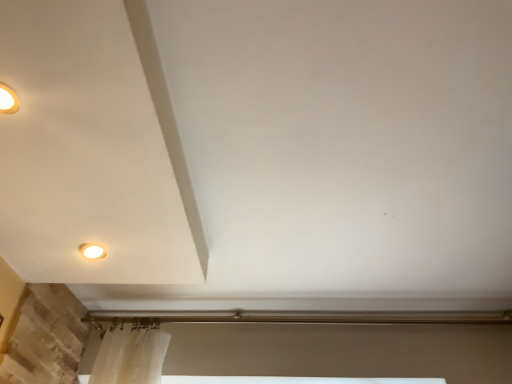
Question: Considering their positions, is matte white lamp at lower left located in front of or behind white glossy light fixture at upper left?

Choices:
 (A) behind
 (B) front

Answer: (A)

Question: Considering the relative positions of matte white lamp at lower left and white glossy light fixture at upper left in the image provided, is matte white lamp at lower left to the left or to the right of white glossy light fixture at upper left?

Choices:
 (A) left
 (B) right

Answer: (B)

Question: Considering the positions of point (94, 248) and point (1, 99), is point (94, 248) closer or farther from the camera than point (1, 99)?

Choices:
 (A) farther
 (B) closer

Answer: (A)

Question: In terms of height, does white glossy light fixture at upper left look taller or shorter compared to matte white lamp at lower left?

Choices:
 (A) short
 (B) tall

Answer: (A)

Question: Do you think white glossy light fixture at upper left is within matte white lamp at lower left, or outside of it?

Choices:
 (A) outside
 (B) inside

Answer: (A)

Question: Considering their positions, is white glossy light fixture at upper left located in front of or behind matte white lamp at lower left?

Choices:
 (A) front
 (B) behind

Answer: (A)

Question: Considering the positions of white glossy light fixture at upper left and matte white lamp at lower left in the image, is white glossy light fixture at upper left bigger or smaller than matte white lamp at lower left?

Choices:
 (A) small
 (B) big

Answer: (B)